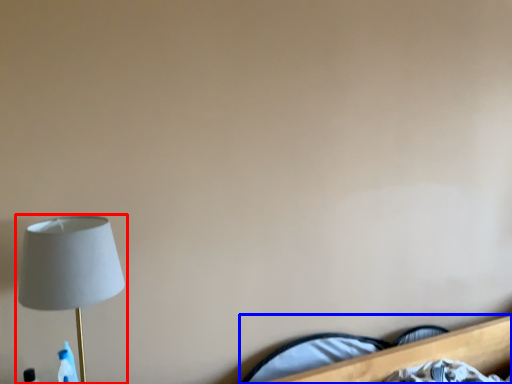
Question: Among these objects, which one is farthest to the camera, lamp (highlighted by a red box) or bed (highlighted by a blue box)?

Choices:
 (A) lamp
 (B) bed

Answer: (B)